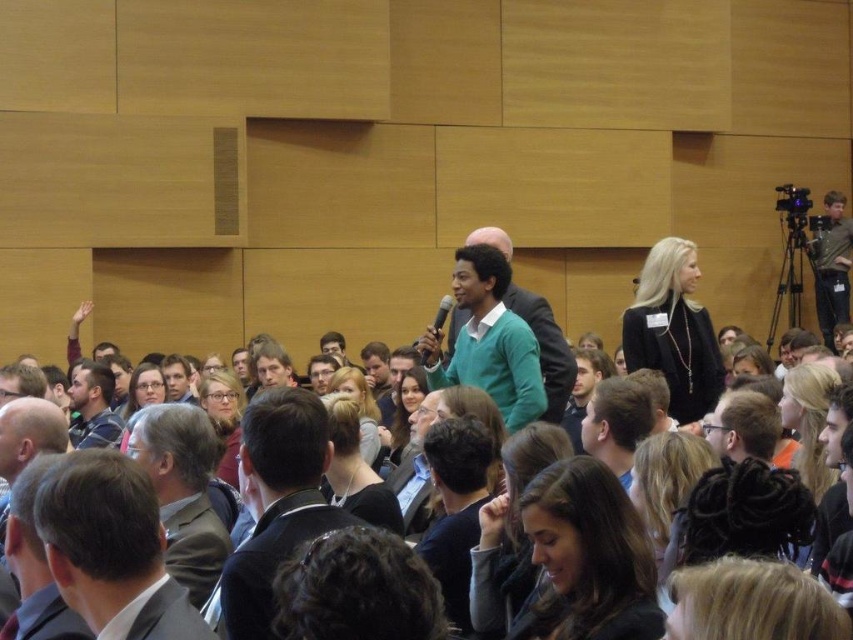
You are a photographer at the event and need to capture a photo of the dark blue sweater at center without the matte black camera at upper right appearing in the frame. Is this possible based on their positions?

The dark blue sweater at center is located below the matte black camera at upper right, so adjusting the camera angle downward might allow you to capture the sweater without the camera obstructing the view.

You are organizing a photo shoot and need to ensure that the dark blue sweater at center and the matte black camera at upper right are both visible in the frame. Given their sizes, which object might require more space horizontally to be fully captured?

The dark blue sweater at center requires more horizontal space because its width surpasses that of the matte black camera at upper right.